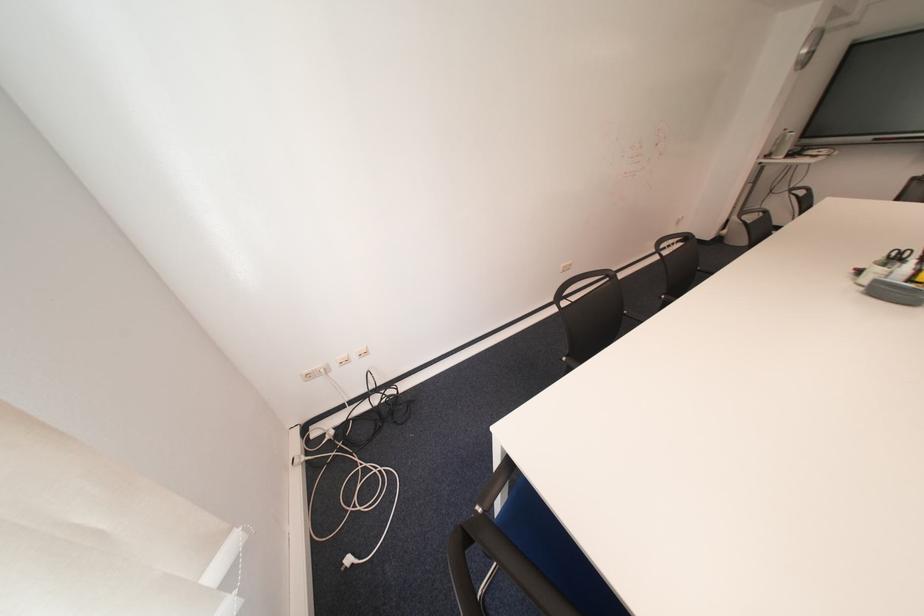
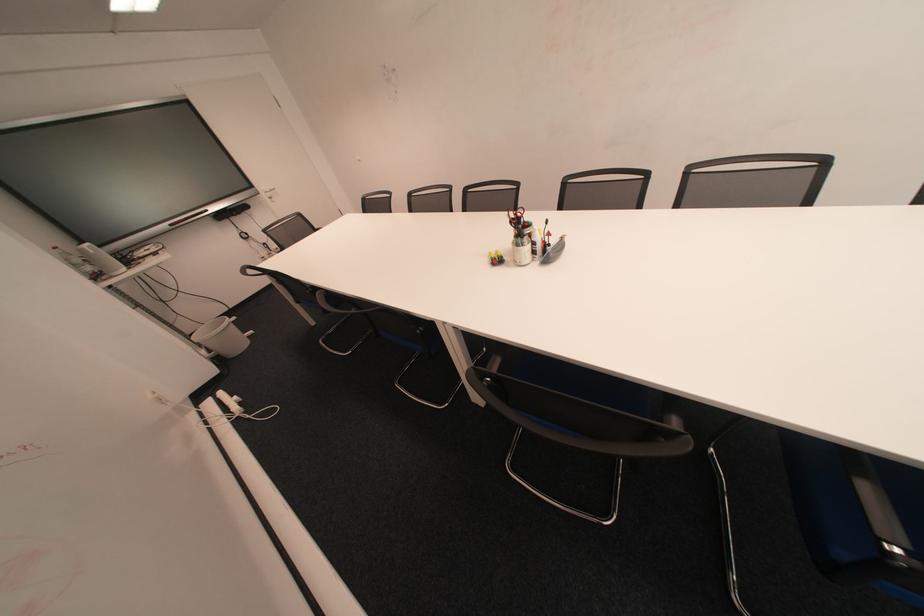
Find the pixel in the second image that matches (895,265) in the first image.

(529, 245)